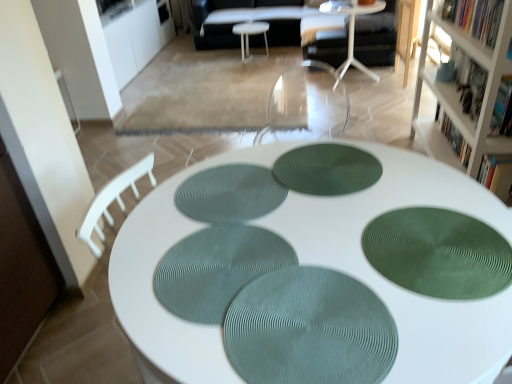
This screenshot has width=512, height=384. What are the coordinates of `free space between green textured mat at lower right, acting as the fourth mat starting from the left, and green textured placemat at center` in the screenshot? It's located at (369, 273).